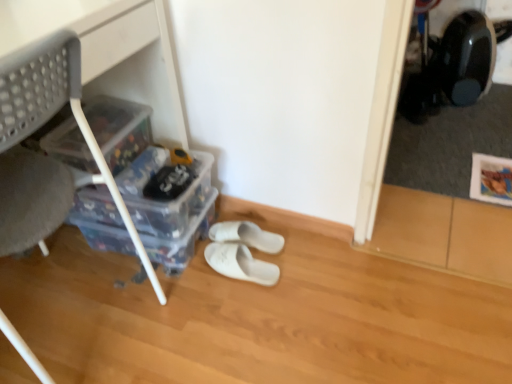
Where is `free space in front of white fabric slippers at center, which is counted as the second footwear, starting from the front`? free space in front of white fabric slippers at center, which is counted as the second footwear, starting from the front is located at coordinates (244, 292).